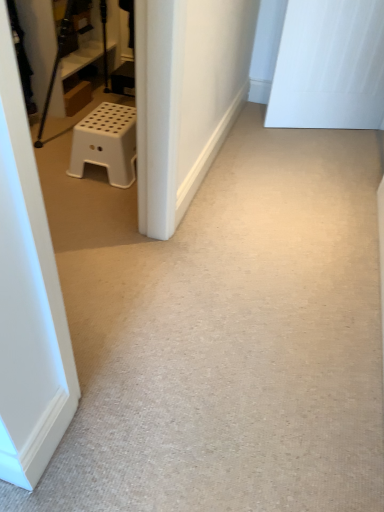
Find the location of `white matte door at upper right`. white matte door at upper right is located at coordinates (329, 66).

Image resolution: width=384 pixels, height=512 pixels. Describe the element at coordinates (329, 66) in the screenshot. I see `white matte door at upper right` at that location.

Identify the location of white plastic stool at left. This screenshot has width=384, height=512. (106, 143).

What is the approximate width of white plastic stool at left?

13.06 inches.

Describe the element at coordinates (106, 143) in the screenshot. I see `white plastic stool at left` at that location.

Where is `white matte door at upper right`? white matte door at upper right is located at coordinates (329, 66).

Which object is positioned more to the right, white plastic stool at left or white matte door at upper right?

white matte door at upper right.

Between white plastic stool at left and white matte door at upper right, which one is positioned behind?

white matte door at upper right is more distant.

Consider the image. Which is closer to the camera, (76, 176) or (292, 15)?

Point (76, 176) is closer to the camera than point (292, 15).

From the image's perspective, which is above, white plastic stool at left or white matte door at upper right?

From the image's view, white matte door at upper right is above.

From a real-world perspective, is white plastic stool at left physically located above or below white matte door at upper right?

white plastic stool at left is situated lower than white matte door at upper right in the real world.

Considering the sizes of objects white plastic stool at left and white matte door at upper right in the image provided, who is wider, white plastic stool at left or white matte door at upper right?

With larger width is white plastic stool at left.

Between white plastic stool at left and white matte door at upper right, which one has less height?

With less height is white plastic stool at left.

Considering the sizes of objects white plastic stool at left and white matte door at upper right in the image provided, who is bigger, white plastic stool at left or white matte door at upper right?

With larger size is white matte door at upper right.

Is white matte door at upper right inside white plastic stool at left?

No, white matte door at upper right is located outside of white plastic stool at left.

Are white plastic stool at left and white matte door at upper right making contact?

No, white plastic stool at left is not beside white matte door at upper right.

Is white plastic stool at left facing away from white matte door at upper right?

No, white plastic stool at left's orientation is not away from white matte door at upper right.

Can you tell me how much white plastic stool at left and white matte door at upper right differ in facing direction?

They differ by 111 degrees in their facing directions.

Find the location of `door above the white plastic stool at left (from a real-world perspective)`. door above the white plastic stool at left (from a real-world perspective) is located at coordinates (329, 66).

Considering the relative positions of white matte door at upper right and white plastic stool at left in the image provided, is white matte door at upper right to the right of white plastic stool at left from the viewer's perspective?

Yes.

In the scene shown: Which object is closer to the camera, white matte door at upper right or white plastic stool at left?

white plastic stool at left is more forward.

Does point (383, 77) come behind point (116, 113)?

Yes, point (383, 77) is farther from viewer.

From the image's perspective, is white matte door at upper right on top of white plastic stool at left?

Correct, white matte door at upper right appears higher than white plastic stool at left in the image.

From a real-world perspective, which is physically below, white matte door at upper right or white plastic stool at left?

In real-world perspective, white plastic stool at left is lower.

Considering the sizes of objects white matte door at upper right and white plastic stool at left in the image provided, who is thinner, white matte door at upper right or white plastic stool at left?

white matte door at upper right is thinner.

Which of these two, white matte door at upper right or white plastic stool at left, stands taller?

white matte door at upper right.

Between white matte door at upper right and white plastic stool at left, which one has larger size?

Bigger between the two is white matte door at upper right.

Is white matte door at upper right located outside white plastic stool at left?

Yes, white matte door at upper right is located beyond the bounds of white plastic stool at left.

Consider the image. Is white matte door at upper right beside white plastic stool at left?

white matte door at upper right and white plastic stool at left are clearly separated.

Is white matte door at upper right looking in the opposite direction of white plastic stool at left?

No.

How many degrees apart are the facing directions of white matte door at upper right and white plastic stool at left?

111 degrees separate the facing orientations of white matte door at upper right and white plastic stool at left.

Find the location of `furniture in front of the white matte door at upper right`. furniture in front of the white matte door at upper right is located at coordinates (106, 143).

In the image, there is a white matte door at upper right. At what (x,y) coordinates should I click in order to perform the action: click on furniture below it (from the image's perspective). Please return your answer as a coordinate pair (x, y). Looking at the image, I should click on click(106, 143).

The image size is (384, 512). There is a white plastic stool at left. Find the location of `door above it (from a real-world perspective)`. door above it (from a real-world perspective) is located at coordinates (329, 66).